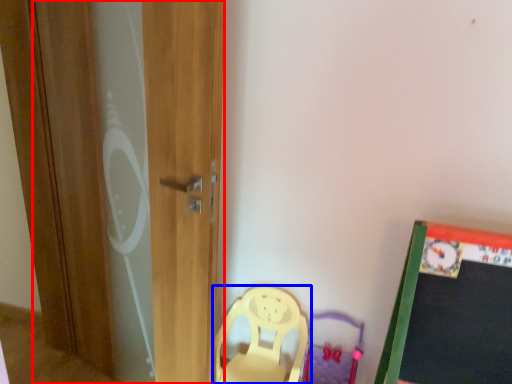
Question: Which object is further to the camera taking this photo, screen door (highlighted by a red box) or chair (highlighted by a blue box)?

Choices:
 (A) screen door
 (B) chair

Answer: (B)